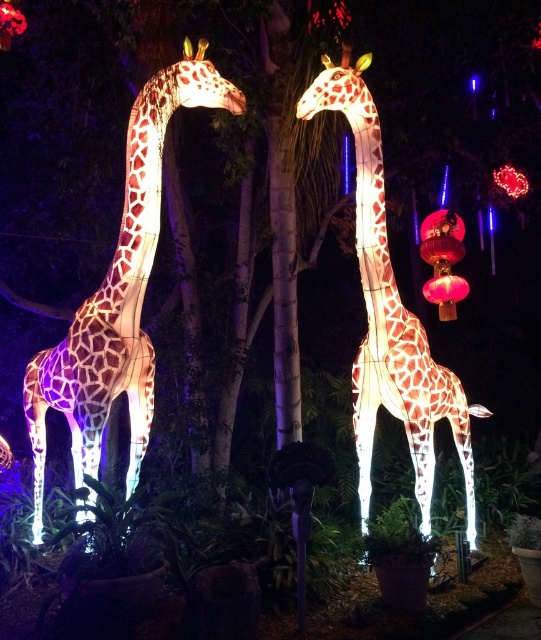
Question: Can you confirm if illuminated mesh giraffe at left is positioned below illuminated mesh giraffe at center?

Choices:
 (A) no
 (B) yes

Answer: (A)

Question: Which object is closer to the camera taking this photo?

Choices:
 (A) illuminated mesh giraffe at center
 (B) illuminated mesh giraffe at left

Answer: (B)

Question: Can you confirm if illuminated mesh giraffe at left is positioned below illuminated mesh giraffe at center?

Choices:
 (A) no
 (B) yes

Answer: (A)

Question: Which object appears closest to the camera in this image?

Choices:
 (A) illuminated mesh giraffe at left
 (B) illuminated mesh giraffe at center

Answer: (A)

Question: Which of the following is the farthest from the observer?

Choices:
 (A) pyautogui.click(x=469, y=506)
 (B) pyautogui.click(x=68, y=360)

Answer: (A)

Question: Is illuminated mesh giraffe at left above illuminated mesh giraffe at center?

Choices:
 (A) no
 (B) yes

Answer: (B)